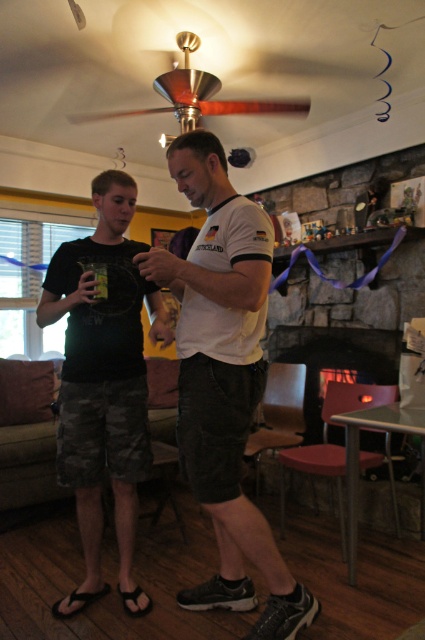
You are standing in the living room and need to place a small decorative item between the two points marked as point (82, 372) and point (190, 49). Based on their positions, which point should the item be closer to?

The small decorative item should be placed closer to point (190, 49) because point (82, 372) is in front of it, meaning the item needs to be positioned behind point (82, 372) to maintain spatial order.

You are a guest in the living room and want to avoid getting wet from the ceiling fan. Where should you stand relative to the camouflage shorts at center and the wooden ceiling fan at upper center?

You should stand away from the camouflage shorts at center because it is positioned under the wooden ceiling fan at upper center, which might drip water or condensation.